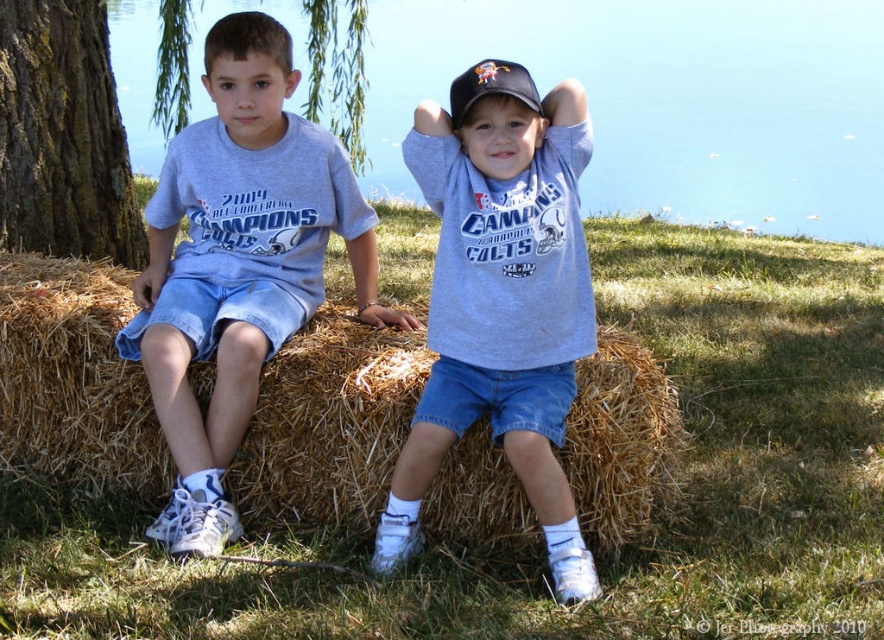
You are standing in a field and see the blue water at upper center and the brown straw bale at center. Which object is closer to you?

The blue water at upper center is closer to you because it is further to the viewer than the brown straw bale at center.

You are planning to place a new bench in the outdoor area shown. The bench requires a space wider than the brown rough bark tree at left. Can the brown straw bale at center provide enough space for the bench?

The brown straw bale at center is wider than the brown rough bark tree at left, so it can provide enough space for the bench.

You are standing at a point 10 meters away from the image. A point labeled as point (774, 179) is marked in the image. Is this point closer to you or farther away than your current position?

The distance of point (774, 179) from viewer is 10.44 meters, so the point is farther away than your current position which is 10 meters away.